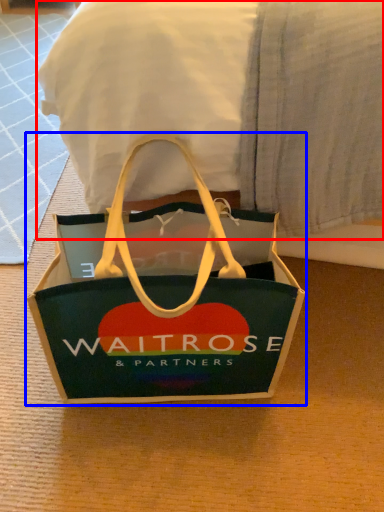
Question: Among these objects, which one is nearest to the camera, bedding (highlighted by a red box) or handbag (highlighted by a blue box)?

Choices:
 (A) bedding
 (B) handbag

Answer: (A)